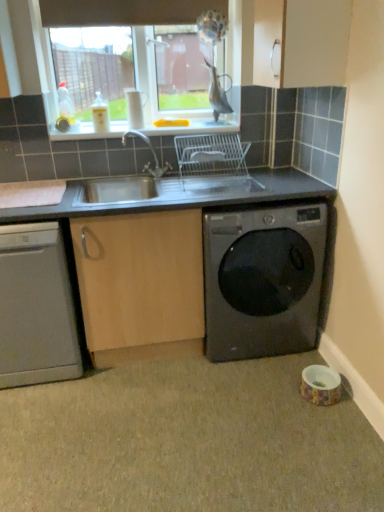
At what (x,y) coordinates should I click in order to perform the action: click on gray matte granite at lower right. Please return your answer as a coordinate pair (x, y). This screenshot has height=512, width=384. Looking at the image, I should click on (187, 441).

Image resolution: width=384 pixels, height=512 pixels. Describe the element at coordinates (125, 12) in the screenshot. I see `brown fabric exhaust hood at upper center` at that location.

The height and width of the screenshot is (512, 384). Describe the element at coordinates (194, 127) in the screenshot. I see `white plastic sink at upper center` at that location.

The height and width of the screenshot is (512, 384). Find the location of `gray matte granite at lower right`. gray matte granite at lower right is located at coordinates (187, 441).

In the scene shown: Who is shorter, gray matte granite at lower right or brown fabric exhaust hood at upper center?

gray matte granite at lower right is shorter.

Is gray matte granite at lower right situated inside brown fabric exhaust hood at upper center or outside?

gray matte granite at lower right is spatially situated outside brown fabric exhaust hood at upper center.

Is gray matte granite at lower right positioned in front of brown fabric exhaust hood at upper center?

That is True.

Between gray matte granite at lower right and brown fabric exhaust hood at upper center, which one has larger size?

With larger size is gray matte granite at lower right.

Is satin silver dishwasher at lower left positioned with its back to black glossy washing machine at lower right?

No, black glossy washing machine at lower right is not at the back of satin silver dishwasher at lower left.

The width and height of the screenshot is (384, 512). Find the location of `dishwasher in front of the black glossy washing machine at lower right`. dishwasher in front of the black glossy washing machine at lower right is located at coordinates (36, 307).

Can you see satin silver dishwasher at lower left touching black glossy washing machine at lower right?

satin silver dishwasher at lower left and black glossy washing machine at lower right are clearly separated.

Which object is positioned more to the right, satin silver dishwasher at lower left or black glossy washing machine at lower right?

black glossy washing machine at lower right.

Considering the points (209, 334) and (124, 11), which point is in front, point (209, 334) or point (124, 11)?

Positioned in front is point (209, 334).

Is black glossy washing machine at lower right completely or partially outside of brown fabric exhaust hood at upper center?

Yes, black glossy washing machine at lower right is located beyond the bounds of brown fabric exhaust hood at upper center.

Does black glossy washing machine at lower right have a larger size compared to brown fabric exhaust hood at upper center?

Yes, black glossy washing machine at lower right is bigger than brown fabric exhaust hood at upper center.

Is black glossy washing machine at lower right directly adjacent to brown fabric exhaust hood at upper center?

→ No, black glossy washing machine at lower right is not making contact with brown fabric exhaust hood at upper center.

Is satin silver dishwasher at lower left spatially inside brown fabric exhaust hood at upper center, or outside of it?

satin silver dishwasher at lower left cannot be found inside brown fabric exhaust hood at upper center.

Considering the sizes of satin silver dishwasher at lower left and brown fabric exhaust hood at upper center in the image, is satin silver dishwasher at lower left taller or shorter than brown fabric exhaust hood at upper center?

In the image, satin silver dishwasher at lower left appears to be taller than brown fabric exhaust hood at upper center.

Is satin silver dishwasher at lower left aimed at brown fabric exhaust hood at upper center?

No, satin silver dishwasher at lower left is not turned towards brown fabric exhaust hood at upper center.

From the picture: Considering the relative positions of satin silver dishwasher at lower left and brown fabric exhaust hood at upper center in the image provided, is satin silver dishwasher at lower left to the right of brown fabric exhaust hood at upper center from the viewer's perspective?

Incorrect, satin silver dishwasher at lower left is not on the right side of brown fabric exhaust hood at upper center.

Considering the positions of objects white plastic sink at upper center and brown fabric exhaust hood at upper center in the image provided, who is more to the right, white plastic sink at upper center or brown fabric exhaust hood at upper center?

From the viewer's perspective, white plastic sink at upper center appears more on the right side.

Which is less distant, [147,126] or [154,18]?

Point [147,126].

Based on the photo, between white plastic sink at upper center and brown fabric exhaust hood at upper center, which one has smaller width?

brown fabric exhaust hood at upper center is thinner.

Is black glossy washing machine at lower right not within satin silver dishwasher at lower left?

Indeed, black glossy washing machine at lower right is completely outside satin silver dishwasher at lower left.

I want to click on washing machine that is above the satin silver dishwasher at lower left (from the image's perspective), so click(x=262, y=281).

Considering the relative sizes of black glossy washing machine at lower right and satin silver dishwasher at lower left in the image provided, is black glossy washing machine at lower right bigger than satin silver dishwasher at lower left?

Yes, black glossy washing machine at lower right is bigger than satin silver dishwasher at lower left.

Is black glossy washing machine at lower right facing towards satin silver dishwasher at lower left?

No, black glossy washing machine at lower right does not turn towards satin silver dishwasher at lower left.

Are brown fabric exhaust hood at upper center and gray matte granite at lower right far apart?

brown fabric exhaust hood at upper center is far away from gray matte granite at lower right.

Does brown fabric exhaust hood at upper center have a larger size compared to gray matte granite at lower right?

Actually, brown fabric exhaust hood at upper center might be smaller than gray matte granite at lower right.

Identify the location of granite located on the right of brown fabric exhaust hood at upper center. This screenshot has height=512, width=384. (187, 441).

Locate an element on the screen. This screenshot has height=512, width=384. exhaust hood on the left of gray matte granite at lower right is located at coordinates (125, 12).

Where is `washing machine to the right of satin silver dishwasher at lower left`? Image resolution: width=384 pixels, height=512 pixels. washing machine to the right of satin silver dishwasher at lower left is located at coordinates (262, 281).

Looking at the image, which one is located closer to gray matte granite at lower right, black glossy washing machine at lower right or brown fabric exhaust hood at upper center?

The object closer to gray matte granite at lower right is black glossy washing machine at lower right.

Which object lies further to the anchor point gray matte granite at lower right, white plastic sink at upper center or black glossy washing machine at lower right?

white plastic sink at upper center.

Which object lies further to the anchor point white plastic sink at upper center, brown fabric exhaust hood at upper center or black glossy washing machine at lower right?

black glossy washing machine at lower right is positioned further to the anchor white plastic sink at upper center.

When comparing their distances from satin silver dishwasher at lower left, does brown fabric exhaust hood at upper center or white plastic sink at upper center seem further?

Based on the image, brown fabric exhaust hood at upper center appears to be further to satin silver dishwasher at lower left.

Which object lies further to the anchor point white plastic sink at upper center, brown fabric exhaust hood at upper center or gray matte granite at lower right?

gray matte granite at lower right lies further to white plastic sink at upper center than the other object.

When comparing their distances from white plastic sink at upper center, does satin silver dishwasher at lower left or gray matte granite at lower right seem further?

gray matte granite at lower right lies further to white plastic sink at upper center than the other object.

Based on their spatial positions, is white plastic sink at upper center or gray matte granite at lower right closer to brown fabric exhaust hood at upper center?

white plastic sink at upper center.

From the image, which object appears to be farther from gray matte granite at lower right, brown fabric exhaust hood at upper center or satin silver dishwasher at lower left?

brown fabric exhaust hood at upper center.

Where is `window sill located between satin silver dishwasher at lower left and black glossy washing machine at lower right in the left-right direction`? The width and height of the screenshot is (384, 512). window sill located between satin silver dishwasher at lower left and black glossy washing machine at lower right in the left-right direction is located at coordinates (194, 127).

Locate an element on the screen. granite between satin silver dishwasher at lower left and black glossy washing machine at lower right from left to right is located at coordinates (187, 441).

Locate an element on the screen. window sill between brown fabric exhaust hood at upper center and satin silver dishwasher at lower left from top to bottom is located at coordinates (194, 127).

Find the location of `washing machine between white plastic sink at upper center and gray matte granite at lower right in the vertical direction`. washing machine between white plastic sink at upper center and gray matte granite at lower right in the vertical direction is located at coordinates (262, 281).